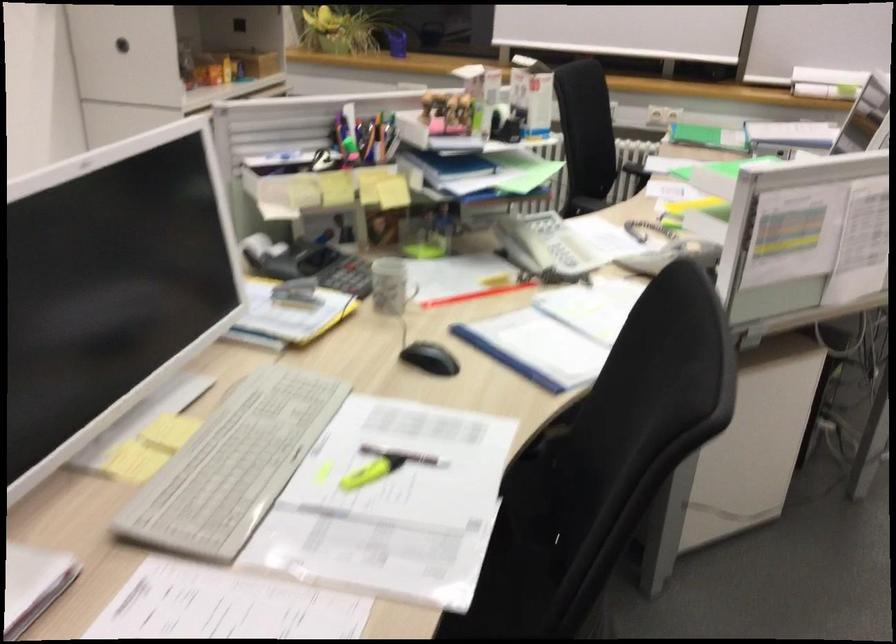
Find where to lift the patterned mug. Please return your answer as a coordinate pair (x, y).

(389, 286)